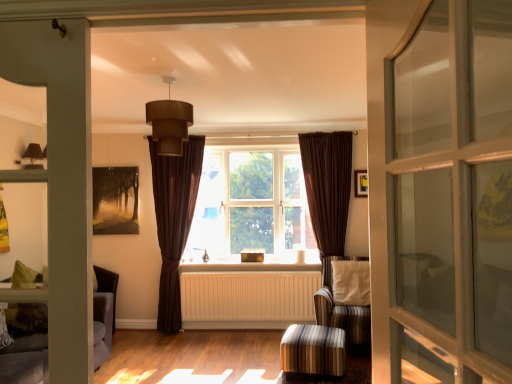
Locate an element on the screen. The width and height of the screenshot is (512, 384). white painted wood at center is located at coordinates (252, 262).

Describe the element at coordinates (327, 190) in the screenshot. I see `brown velvet curtain at center, marked as the second curtain in a left-to-right arrangement` at that location.

Locate an element on the screen. This screenshot has width=512, height=384. matte brown lampshade at upper center is located at coordinates (169, 123).

Measure the distance between striped fabric armchair at center and camera.

striped fabric armchair at center and camera are 3.72 meters apart.

Image resolution: width=512 pixels, height=384 pixels. What are the coordinates of `clear glass screen door at right` in the screenshot? It's located at (450, 195).

Image resolution: width=512 pixels, height=384 pixels. In order to click on white painted wood at center in this screenshot , I will do `click(252, 262)`.

Which object is closer to the camera taking this photo, striped fabric stool at lower center or white matte radiator at center?

striped fabric stool at lower center is more forward.

How many degrees apart are the facing directions of striped fabric stool at lower center and white matte radiator at center?

The angle between the facing direction of striped fabric stool at lower center and the facing direction of white matte radiator at center is 7.71 degrees.

Can you confirm if striped fabric stool at lower center is smaller than white matte radiator at center?

Yes, striped fabric stool at lower center is smaller than white matte radiator at center.

From the image's perspective, is striped fabric stool at lower center located above white matte radiator at center?

No.

Which is farther from the camera, (x=186, y=169) or (x=95, y=349)?

The point (x=186, y=169) is more distant.

Is brown velvet curtain at center, the second curtain positioned from the right, looking in the opposite direction of velvet grey couch at left?

That's not correct — brown velvet curtain at center, the second curtain positioned from the right, is not looking away from velvet grey couch at left.

Can you confirm if brown velvet curtain at center, positioned as the first curtain in left-to-right order, is taller than velvet grey couch at left?

Indeed, brown velvet curtain at center, positioned as the first curtain in left-to-right order, has a greater height compared to velvet grey couch at left.

Considering the relative sizes of brown velvet curtain at center, positioned as the first curtain in left-to-right order, and velvet grey couch at left in the image provided, is brown velvet curtain at center, positioned as the first curtain in left-to-right order, wider than velvet grey couch at left?

Incorrect, the width of brown velvet curtain at center, positioned as the first curtain in left-to-right order, does not surpass that of velvet grey couch at left.

Is brown velvet curtain at center, positioned as the first curtain in left-to-right order, to the left or to the right of brown velvet curtain at center, marked as the second curtain in a left-to-right arrangement, in the image?

From the image, it's evident that brown velvet curtain at center, positioned as the first curtain in left-to-right order, is to the left of brown velvet curtain at center, marked as the second curtain in a left-to-right arrangement.

Considering the sizes of objects brown velvet curtain at center, the second curtain positioned from the right, and brown velvet curtain at center, marked as the second curtain in a left-to-right arrangement, in the image provided, who is thinner, brown velvet curtain at center, the second curtain positioned from the right, or brown velvet curtain at center, marked as the second curtain in a left-to-right arrangement,?

brown velvet curtain at center, marked as the second curtain in a left-to-right arrangement.

In the image, is brown velvet curtain at center, positioned as the first curtain in left-to-right order, positioned in front of or behind brown velvet curtain at center, the 1th curtain viewed from the right?

Clearly, brown velvet curtain at center, positioned as the first curtain in left-to-right order, is behind brown velvet curtain at center, the 1th curtain viewed from the right.

Which is nearer, (195, 163) or (319, 209)?

Point (195, 163) is positioned farther from the camera compared to point (319, 209).

From the image's perspective, which one is positioned higher, matte brown lampshade at upper center or striped fabric armchair at center?

matte brown lampshade at upper center appears higher in the image.

What's the angular difference between matte brown lampshade at upper center and striped fabric armchair at center's facing directions?

The facing directions of matte brown lampshade at upper center and striped fabric armchair at center are 9.36 degrees apart.

Considering the points (175, 109) and (324, 306), which point is behind, point (175, 109) or point (324, 306)?

The point (324, 306) is more distant.

From a real-world perspective, between clear glass screen door at right and white painted wood at center, who is vertically lower?

white painted wood at center, from a real-world perspective.

From the image's perspective, which one is positioned lower, clear glass screen door at right or white painted wood at center?

white painted wood at center is shown below in the image.

Consider the image. Is clear glass screen door at right looking in the opposite direction of white painted wood at center?

No, white painted wood at center is not at the back of clear glass screen door at right.

Considering the relative sizes of white matte radiator at center and brown velvet curtain at center, the second curtain positioned from the right, in the image provided, is white matte radiator at center bigger than brown velvet curtain at center, the second curtain positioned from the right,?

Incorrect, white matte radiator at center is not larger than brown velvet curtain at center, the second curtain positioned from the right.

Is white matte radiator at center at the left side of brown velvet curtain at center, positioned as the first curtain in left-to-right order?

Incorrect, white matte radiator at center is not on the left side of brown velvet curtain at center, positioned as the first curtain in left-to-right order.

Is white matte radiator at center closer to the viewer compared to brown velvet curtain at center, positioned as the first curtain in left-to-right order?

No, white matte radiator at center is further to the viewer.

Between white matte radiator at center and white painted wood at center, which one has less height?

white painted wood at center is shorter.

Is white matte radiator at center turned away from white painted wood at center?

white matte radiator at center is not turned away from white painted wood at center.

Considering the relative sizes of white matte radiator at center and white painted wood at center in the image provided, is white matte radiator at center thinner than white painted wood at center?

Yes.

This screenshot has width=512, height=384. Find the location of `stool lying below the white matte radiator at center (from the image's perspective)`. stool lying below the white matte radiator at center (from the image's perspective) is located at coordinates (313, 350).

In the image, there is a brown velvet curtain at center, positioned as the first curtain in left-to-right order. What are the coordinates of `studio couch below it (from a real-world perspective)` in the screenshot? It's located at (25, 360).

Estimate the real-world distances between objects in this image. Which object is further from matte brown lampshade at upper center, white matte radiator at center or striped fabric armchair at center?

The object further to matte brown lampshade at upper center is white matte radiator at center.

Based on the photo, which object lies further to the anchor point matte brown lampshade at upper center, striped fabric armchair at center or brown velvet curtain at center, marked as the second curtain in a left-to-right arrangement?

Based on the image, striped fabric armchair at center appears to be further to matte brown lampshade at upper center.

Based on their spatial positions, is striped fabric stool at lower center or matte brown lampshade at upper center closer to clear glass screen door at right?

matte brown lampshade at upper center.

In the scene shown: Considering their positions, is striped fabric armchair at center positioned further to brown velvet curtain at center, positioned as the first curtain in left-to-right order, than striped fabric stool at lower center?

striped fabric stool at lower center.

Estimate the real-world distances between objects in this image. Which object is further from brown velvet curtain at center, marked as the second curtain in a left-to-right arrangement, white matte radiator at center or clear glass screen door at right?

Among the two, clear glass screen door at right is located further to brown velvet curtain at center, marked as the second curtain in a left-to-right arrangement.

From the image, which object appears to be farther from brown velvet curtain at center, marked as the second curtain in a left-to-right arrangement, brown fabric curtain at center or striped fabric armchair at center?

The object further to brown velvet curtain at center, marked as the second curtain in a left-to-right arrangement, is striped fabric armchair at center.

Based on their spatial positions, is white matte radiator at center or brown velvet curtain at center, positioned as the first curtain in left-to-right order, further from brown fabric curtain at center?

Among the two, white matte radiator at center is located further to brown fabric curtain at center.

Looking at the image, which one is located further to brown velvet curtain at center, marked as the second curtain in a left-to-right arrangement, clear glass screen door at right or brown fabric curtain at center?

Among the two, clear glass screen door at right is located further to brown velvet curtain at center, marked as the second curtain in a left-to-right arrangement.

You are a GUI agent. You are given a task and a screenshot of the screen. Output one action in this format:
    pyautogui.click(x=<x>, y=<y>)
    Task: Click on the window between velvet grey couch at left and striped fabric stool at lower center from left to right
    Image resolution: width=512 pixels, height=384 pixels.
    Given the screenshot: What is the action you would take?
    point(251,205)

At what (x,y) coordinates should I click in order to perform the action: click on stool between matte brown lampshade at upper center and brown fabric curtain at center along the z-axis. Please return your answer as a coordinate pair (x, y). The width and height of the screenshot is (512, 384). Looking at the image, I should click on click(x=313, y=350).

At what (x,y) coordinates should I click in order to perform the action: click on lamp between clear glass screen door at right and velvet grey couch at left from front to back. Please return your answer as a coordinate pair (x, y). Looking at the image, I should click on tap(169, 123).

Where is `window sill between velvet grey couch at left and striped fabric stool at lower center from left to right`? The width and height of the screenshot is (512, 384). window sill between velvet grey couch at left and striped fabric stool at lower center from left to right is located at coordinates (252, 262).